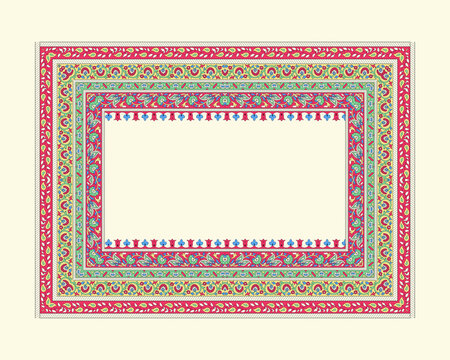
The image size is (450, 360). I want to click on rug, so click(402, 287).